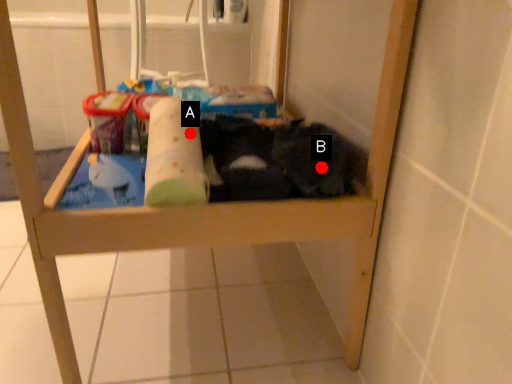
Question: Two points are circled on the image, labeled by A and B beside each circle. Which point is closer to the camera?

Choices:
 (A) A is closer
 (B) B is closer

Answer: (A)